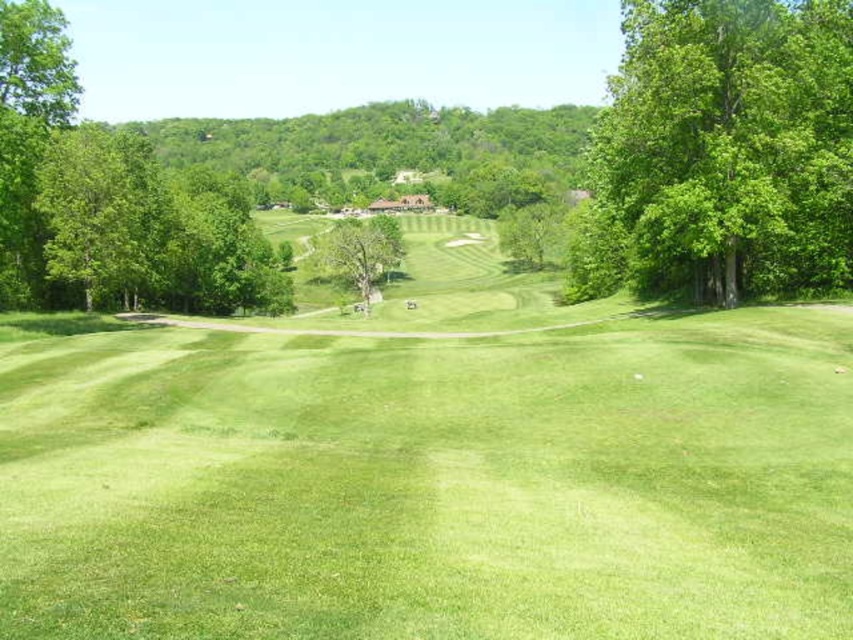
Question: Which point is closer to the camera?

Choices:
 (A) green grassy field at center
 (B) green leafy tree at center

Answer: (A)

Question: Is green grassy field at center further to camera compared to green leafy tree at right?

Choices:
 (A) no
 (B) yes

Answer: (A)

Question: Which point is closer to the camera taking this photo?

Choices:
 (A) click(329, 228)
 (B) click(721, 550)

Answer: (B)

Question: Is green leafy tree at right above green leafy tree at center?

Choices:
 (A) yes
 (B) no

Answer: (B)

Question: Is green leafy tree at right bigger than green leafy tree at center?

Choices:
 (A) no
 (B) yes

Answer: (A)

Question: Which is farther from the green leafy tree at center?

Choices:
 (A) green grassy field at center
 (B) green leafy tree at right

Answer: (A)